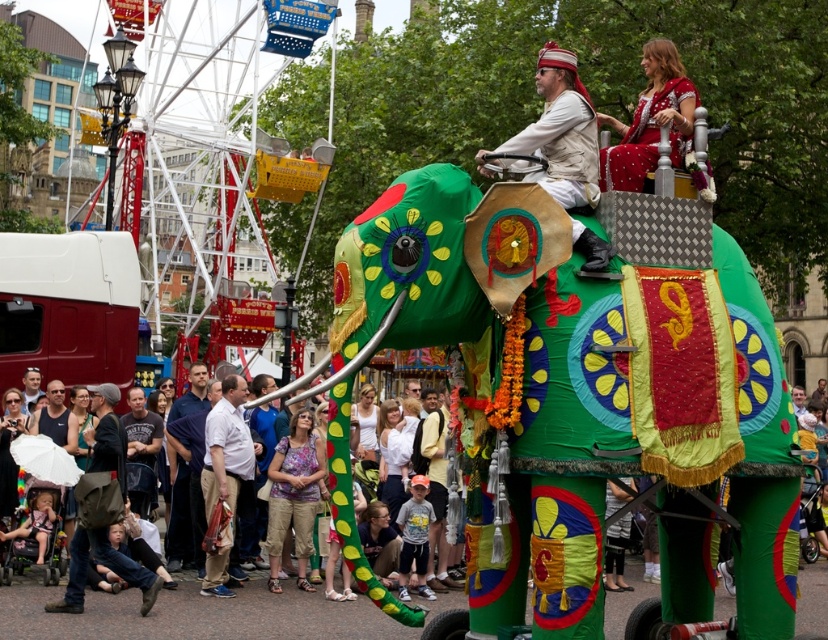
Question: Does red embroidered dress at upper center have a larger size compared to white cotton shirt at center?

Choices:
 (A) no
 (B) yes

Answer: (A)

Question: Which object is farther from the camera taking this photo?

Choices:
 (A) matte white umbrella at lower left
 (B) red embroidered dress at upper center
 (C) green fabric elephant at center

Answer: (B)

Question: Can you confirm if red embroidered dress at upper center is positioned to the left of white cotton shirt at center?

Choices:
 (A) yes
 (B) no

Answer: (B)

Question: Among these points, which one is nearest to the camera?

Choices:
 (A) (176, 566)
 (B) (639, 145)

Answer: (B)

Question: Is green fabric elephant at center further to camera compared to red embroidered dress at upper center?

Choices:
 (A) yes
 (B) no

Answer: (B)

Question: Which object is farther from the camera taking this photo?

Choices:
 (A) green fabric elephant at center
 (B) white cotton shirt at center
 (C) matte white umbrella at lower left
 (D) red embroidered dress at upper center

Answer: (B)